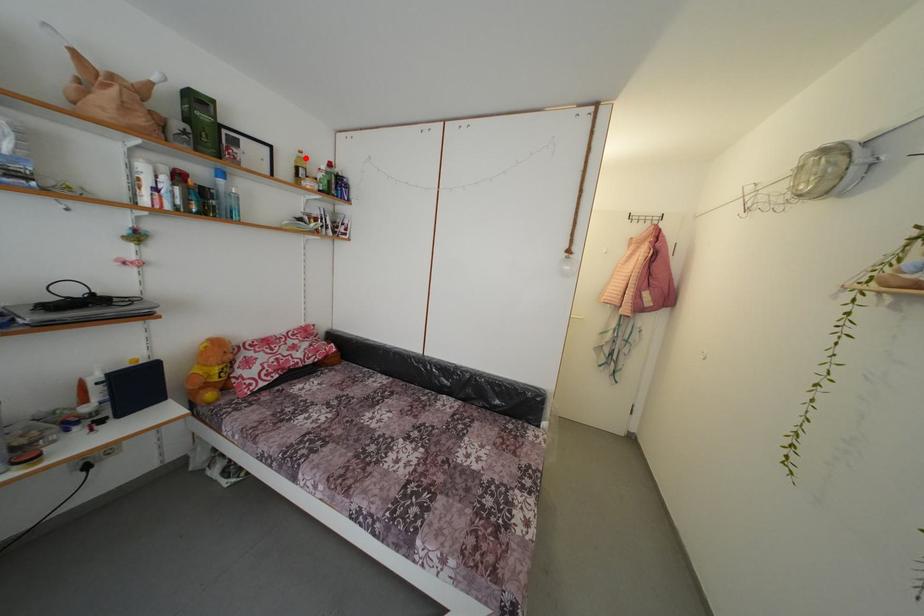
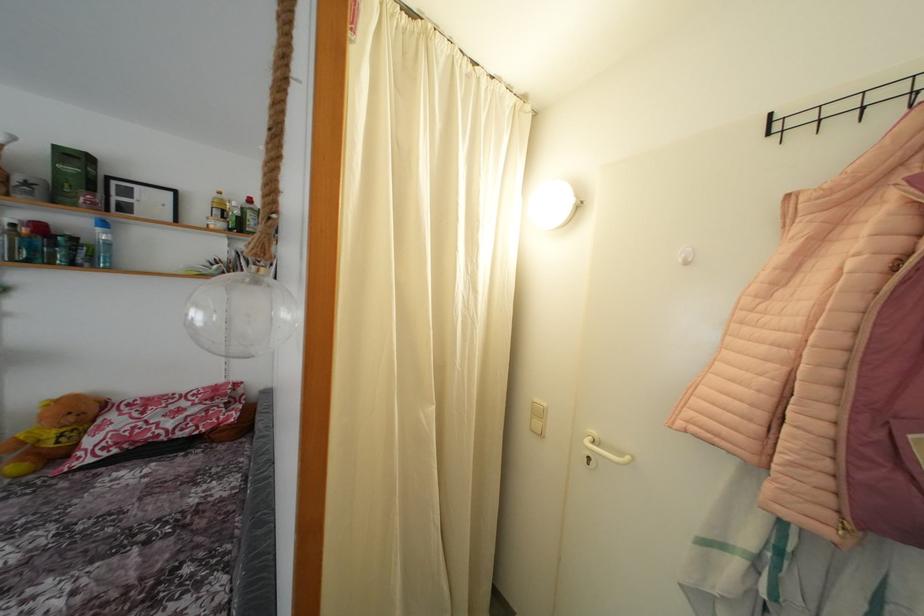
Locate, in the second image, the point that corresponds to the highlighted location in the first image.

(225, 199)